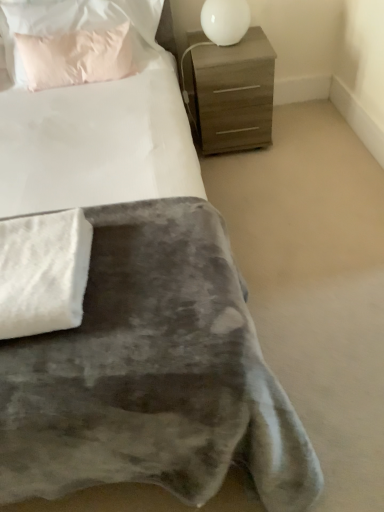
Question: From the image's perspective, is white fluffy blanket at lower left located above or below white glossy table lamp at upper right?

Choices:
 (A) below
 (B) above

Answer: (A)

Question: From a real-world perspective, relative to white glossy table lamp at upper right, is white fluffy blanket at lower left vertically above or below?

Choices:
 (A) below
 (B) above

Answer: (A)

Question: Estimate the real-world distances between objects in this image. Which object is farther from the white glossy table lamp at upper right?

Choices:
 (A) white fluffy blanket at lower left
 (B) pink fabric pillow at upper left
 (C) matte brown chest of drawers at upper right

Answer: (A)

Question: Which object is the farthest from the white glossy table lamp at upper right?

Choices:
 (A) matte brown chest of drawers at upper right
 (B) white fluffy blanket at lower left
 (C) pink fabric pillow at upper left

Answer: (B)